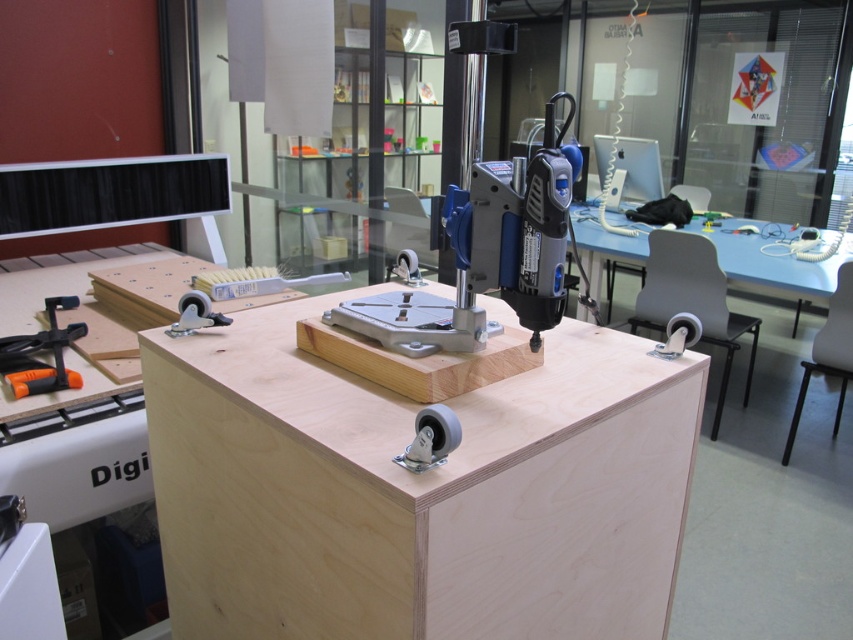
You are organizing tools in a workshop and need to place the orange plastic clamp at lower left on a surface. Can you put it on the light blue plastic table at center without moving the table?

The orange plastic clamp at lower left is behind the light blue plastic table at center, so you can move it to the light blue plastic table at center as long as there is space available on the table.

You are setting up a workspace and need to place both the plywood table at center and the blue plastic drill at center. Since you want to ensure the drill is easily accessible without being hidden, which object should you place higher?

The plywood table at center has a greater height compared to the blue plastic drill at center. To ensure the drill is easily accessible without being hidden, you should place the blue plastic drill at center lower than the plywood table at center.